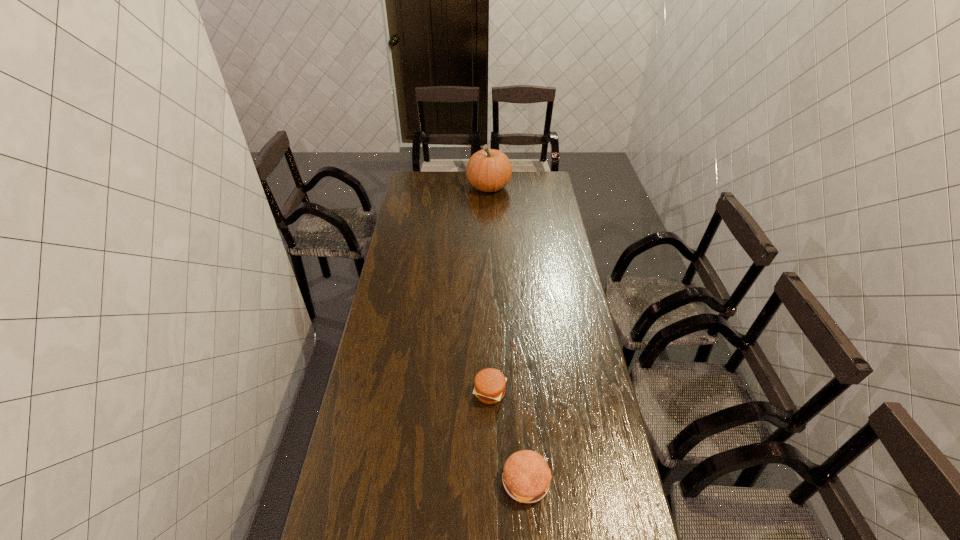
Where is `free space in the image that satisfies the following two spatial constraints: 1. on the stem of the farthest object; 2. on the front side of the second farthest object`? free space in the image that satisfies the following two spatial constraints: 1. on the stem of the farthest object; 2. on the front side of the second farthest object is located at coordinates (494, 392).